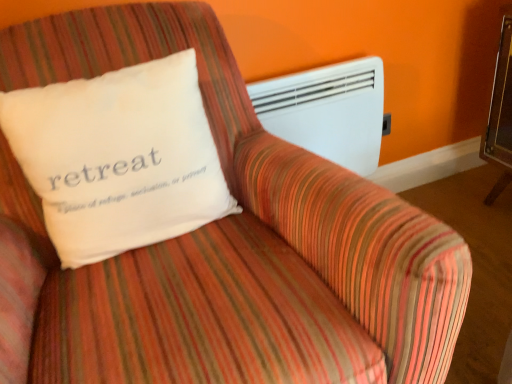
Question: Should I look upward or downward to see white plastic heater at upper right?

Choices:
 (A) down
 (B) up

Answer: (B)

Question: Would you say white soft pillow at upper left contains white plastic heater at upper right?

Choices:
 (A) no
 (B) yes

Answer: (A)

Question: From a real-world perspective, is white soft pillow at upper left below white plastic heater at upper right?

Choices:
 (A) yes
 (B) no

Answer: (B)

Question: Is white soft pillow at upper left facing towards white plastic heater at upper right?

Choices:
 (A) no
 (B) yes

Answer: (A)

Question: Is white soft pillow at upper left further to camera compared to white plastic heater at upper right?

Choices:
 (A) yes
 (B) no

Answer: (B)

Question: Can you confirm if white soft pillow at upper left is bigger than white plastic heater at upper right?

Choices:
 (A) yes
 (B) no

Answer: (A)

Question: From the image's perspective, is white soft pillow at upper left on white plastic heater at upper right?

Choices:
 (A) yes
 (B) no

Answer: (B)

Question: Is white plastic heater at upper right taller than white soft pillow at upper left?

Choices:
 (A) no
 (B) yes

Answer: (B)

Question: Is white plastic heater at upper right behind white soft pillow at upper left?

Choices:
 (A) no
 (B) yes

Answer: (B)

Question: Can you confirm if white plastic heater at upper right is bigger than white soft pillow at upper left?

Choices:
 (A) no
 (B) yes

Answer: (A)

Question: Is white plastic heater at upper right outside white soft pillow at upper left?

Choices:
 (A) yes
 (B) no

Answer: (A)

Question: Is white plastic heater at upper right facing away from white soft pillow at upper left?

Choices:
 (A) yes
 (B) no

Answer: (B)

Question: Does white plastic heater at upper right appear on the right side of white soft pillow at upper left?

Choices:
 (A) no
 (B) yes

Answer: (B)

Question: Choose the correct answer: Is white plastic heater at upper right inside white soft pillow at upper left or outside it?

Choices:
 (A) inside
 (B) outside

Answer: (B)